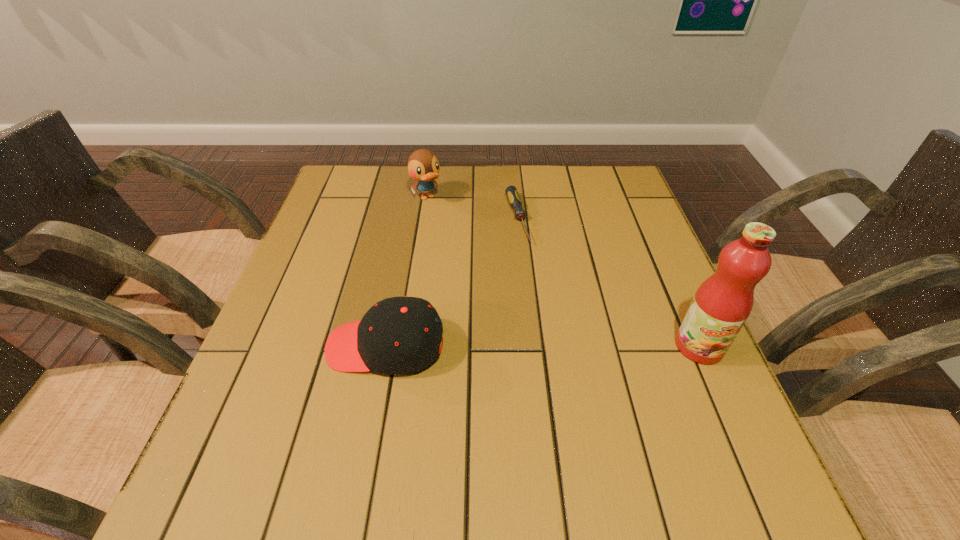
In order to click on vacant space that is in between the second object from right to left and the second shortest object in this screenshot , I will do `click(451, 282)`.

The image size is (960, 540). Identify the location of free spot between the rightmost object and the second tallest object. (563, 272).

Identify the location of free spot between the duck and the second shortest object. (406, 272).

Identify which object is the second closest to the screwdriver. Please provide its 2D coordinates. Your answer should be formatted as a tuple, i.e. [(x, y)], where the tuple contains the x and y coordinates of a point satisfying the conditions above.

[(399, 335)]

Locate which object ranks in proximity to the cap. Please provide its 2D coordinates. Your answer should be formatted as a tuple, i.e. [(x, y)], where the tuple contains the x and y coordinates of a point satisfying the conditions above.

[(512, 194)]